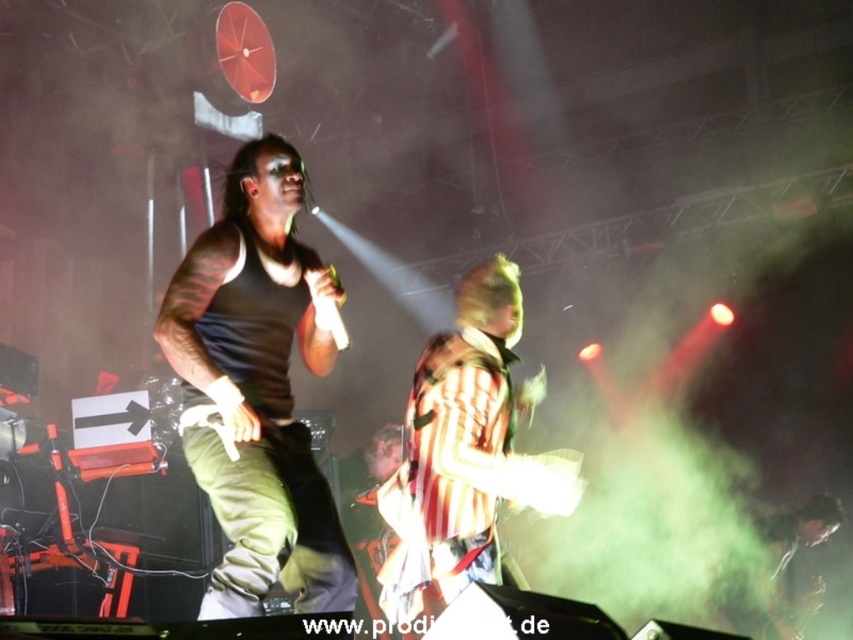
Question: Can you confirm if striped shirt at center is positioned below shiny black hair at center?

Choices:
 (A) no
 (B) yes

Answer: (A)

Question: Among these objects, which one is farthest from the camera?

Choices:
 (A) shiny black hair at center
 (B) black matte tank top at center
 (C) striped shirt at center

Answer: (A)

Question: Estimate the real-world distances between objects in this image. Which object is farther from the black matte tank top at center?

Choices:
 (A) striped shirt at center
 (B) shiny black hair at center

Answer: (B)

Question: Estimate the real-world distances between objects in this image. Which object is farther from the black matte tank top at center?

Choices:
 (A) shiny black hair at center
 (B) striped shirt at center

Answer: (A)

Question: Does black matte tank top at center appear on the right side of shiny black hair at center?

Choices:
 (A) yes
 (B) no

Answer: (B)

Question: Is black matte tank top at center positioned in front of shiny black hair at center?

Choices:
 (A) yes
 (B) no

Answer: (A)